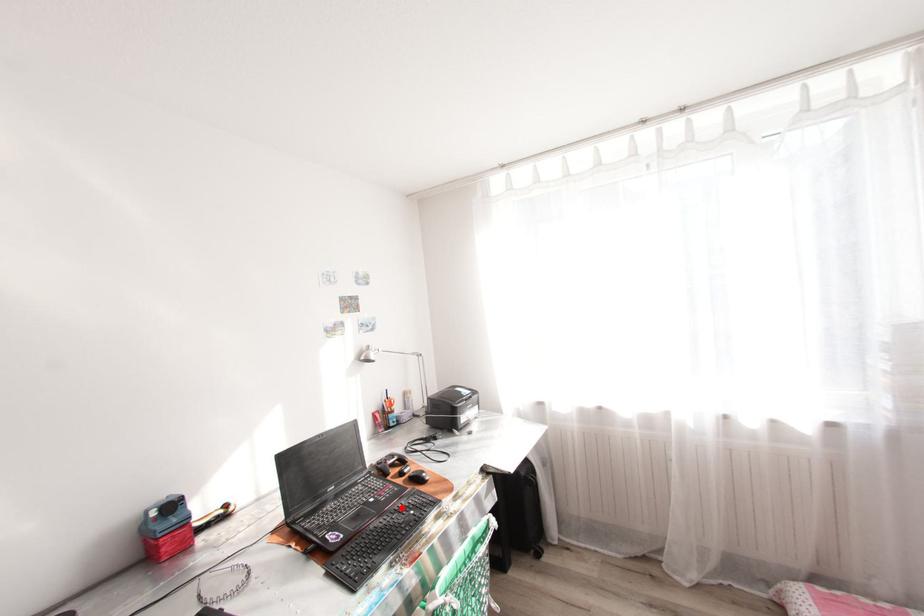
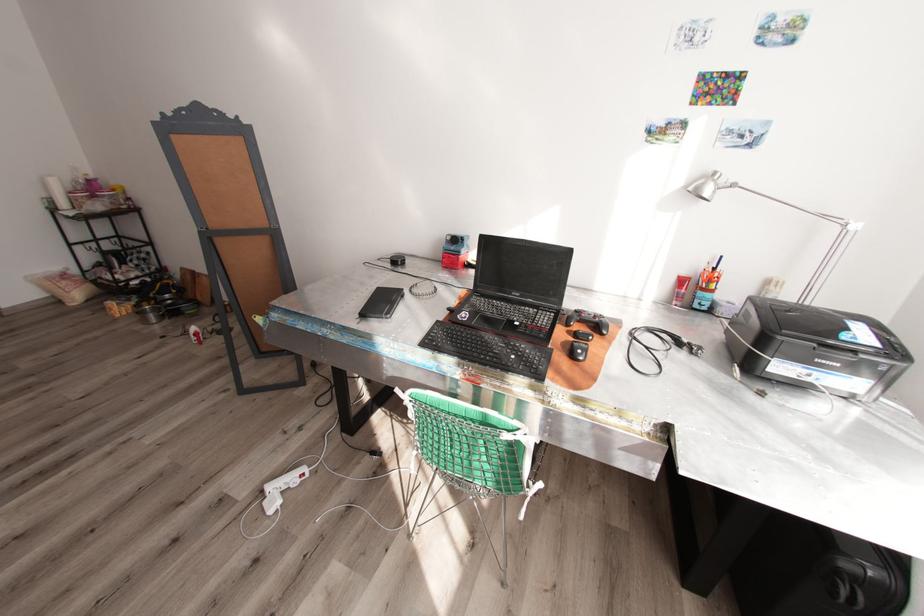
Where in the second image is the point corresponding to the highlighted location from the first image?

(517, 344)